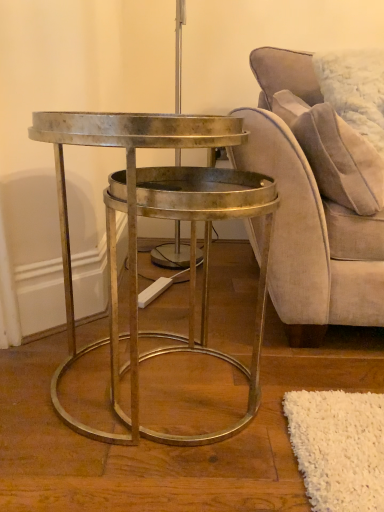
Where is `suede beige chair at right`? Image resolution: width=384 pixels, height=512 pixels. suede beige chair at right is located at coordinates (315, 201).

Where is `suede-like beige pillow at upper right`? The image size is (384, 512). suede-like beige pillow at upper right is located at coordinates (335, 154).

Find the location of `suede beige chair at right`. suede beige chair at right is located at coordinates (315, 201).

Is suede beige chair at right facing away from suede-like beige pillow at upper right?

That's right, suede beige chair at right is facing away from suede-like beige pillow at upper right.

In the scene shown: Which object is positioned more to the right, suede beige chair at right or suede-like beige pillow at upper right?

suede beige chair at right.

From the image's perspective, would you say suede beige chair at right is shown under suede-like beige pillow at upper right?

Indeed, from the image's perspective, suede beige chair at right is shown beneath suede-like beige pillow at upper right.

Considering the sizes of suede beige chair at right and suede-like beige pillow at upper right in the image, is suede beige chair at right taller or shorter than suede-like beige pillow at upper right?

Considering their sizes, suede beige chair at right has more height than suede-like beige pillow at upper right.

Does suede-like beige pillow at upper right lie behind metallic gold table at center?

That is True.

Is suede-like beige pillow at upper right wider or thinner than metallic gold table at center?

Clearly, suede-like beige pillow at upper right has less width compared to metallic gold table at center.

How many degrees apart are the facing directions of suede-like beige pillow at upper right and metallic gold table at center?

88.3 degrees.

Choose the correct answer: Is suede-like beige pillow at upper right inside metallic gold table at center or outside it?

suede-like beige pillow at upper right cannot be found inside metallic gold table at center.

Is metallic gold table at center shorter than suede beige chair at right?

Correct, metallic gold table at center is not as tall as suede beige chair at right.

Which object is closer to the camera taking this photo, metallic gold table at center or suede beige chair at right?

metallic gold table at center.

From the image's perspective, which one is positioned higher, metallic gold table at center or suede beige chair at right?

suede beige chair at right.

Consider the image. What's the angular difference between metallic gold table at center and suede-like beige pillow at upper right's facing directions?

metallic gold table at center and suede-like beige pillow at upper right are facing 88.3 degrees away from each other.

Considering the sizes of objects metallic gold table at center and suede-like beige pillow at upper right in the image provided, who is wider, metallic gold table at center or suede-like beige pillow at upper right?

metallic gold table at center.

Which of these two, metallic gold table at center or suede-like beige pillow at upper right, is smaller?

suede-like beige pillow at upper right.

Who is shorter, metallic gold table at center or suede-like beige pillow at upper right?

Standing shorter between the two is suede-like beige pillow at upper right.

Do you think suede beige chair at right is within metallic gold table at center, or outside of it?

suede beige chair at right lies outside metallic gold table at center.

Is suede beige chair at right facing towards metallic gold table at center?

No, suede beige chair at right is not oriented towards metallic gold table at center.

This screenshot has width=384, height=512. Identify the location of chair behind the metallic gold table at center. (315, 201).

From a real-world perspective, between suede beige chair at right and metallic gold table at center, who is vertically higher?

suede beige chair at right.

From the image's perspective, is suede-like beige pillow at upper right on suede beige chair at right?

Correct, suede-like beige pillow at upper right appears higher than suede beige chair at right in the image.

Is suede beige chair at right surrounded by suede-like beige pillow at upper right?

No, suede beige chair at right is located outside of suede-like beige pillow at upper right.

Which point is more distant from viewer, (314, 160) or (381, 163)?

The point (314, 160) is farther.

Identify the location of chair that is on the right side of suede-like beige pillow at upper right. This screenshot has height=512, width=384. (315, 201).

The image size is (384, 512). I want to click on pillow behind the metallic gold table at center, so click(x=335, y=154).

Based on their spatial positions, is metallic gold table at center or suede beige chair at right closer to suede-like beige pillow at upper right?

Based on the image, suede beige chair at right appears to be nearer to suede-like beige pillow at upper right.

From the image, which object appears to be nearer to metallic gold table at center, suede-like beige pillow at upper right or suede beige chair at right?

Among the two, suede beige chair at right is located nearer to metallic gold table at center.

Based on their spatial positions, is suede-like beige pillow at upper right or metallic gold table at center further from suede beige chair at right?

metallic gold table at center lies further to suede beige chair at right than the other object.

Considering their positions, is suede beige chair at right positioned further to suede-like beige pillow at upper right than metallic gold table at center?

metallic gold table at center is further to suede-like beige pillow at upper right.

Which object lies nearer to the anchor point metallic gold table at center, suede beige chair at right or suede-like beige pillow at upper right?

suede beige chair at right is positioned closer to the anchor metallic gold table at center.

Which object lies nearer to the anchor point suede beige chair at right, metallic gold table at center or suede-like beige pillow at upper right?

suede-like beige pillow at upper right lies closer to suede beige chair at right than the other object.

The height and width of the screenshot is (512, 384). What are the coordinates of `pillow between metallic gold table at center and suede beige chair at right in the horizontal direction` in the screenshot? It's located at (335, 154).